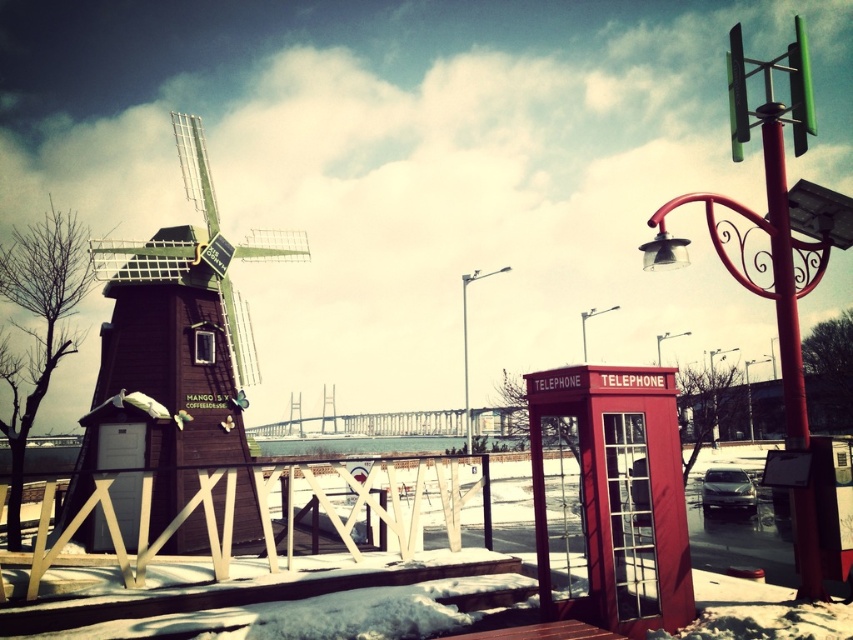
Question: Considering the relative positions of matte red telephone booth at right and red metallic pole at upper right in the image provided, where is matte red telephone booth at right located with respect to red metallic pole at upper right?

Choices:
 (A) right
 (B) left

Answer: (B)

Question: Does matte red telephone booth at right appear on the right side of red metallic pole at upper right?

Choices:
 (A) yes
 (B) no

Answer: (B)

Question: From the image, what is the correct spatial relationship of matte red telephone booth at right in relation to red metallic pole at upper right?

Choices:
 (A) right
 (B) left

Answer: (B)